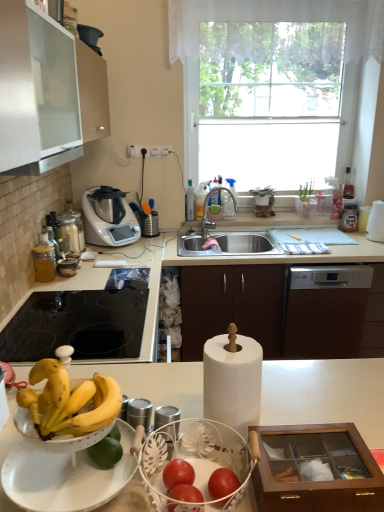
Where is `free point behind wooden box at lower right, the first cabinetry when ordered from front to back`? This screenshot has height=512, width=384. free point behind wooden box at lower right, the first cabinetry when ordered from front to back is located at coordinates (312, 406).